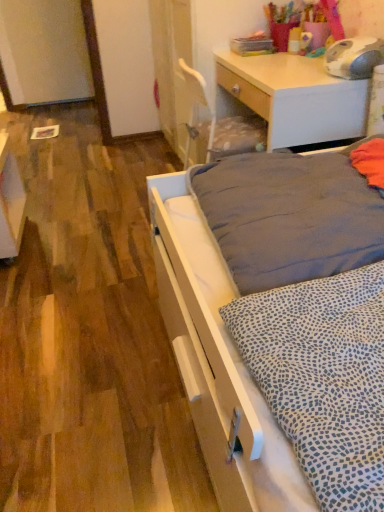
This screenshot has height=512, width=384. Identify the location of blank space situated above white matte bed at lower right (from a real-world perspective). (91, 252).